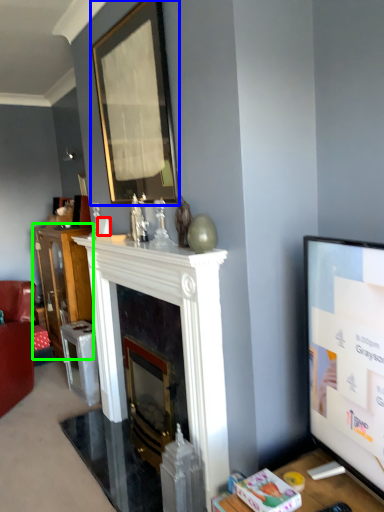
Question: Estimate the real-world distances between objects in this image. Which object is farther from coffee cup (highlighted by a red box), picture frame (highlighted by a blue box) or cabinetry (highlighted by a green box)?

Choices:
 (A) picture frame
 (B) cabinetry

Answer: (B)